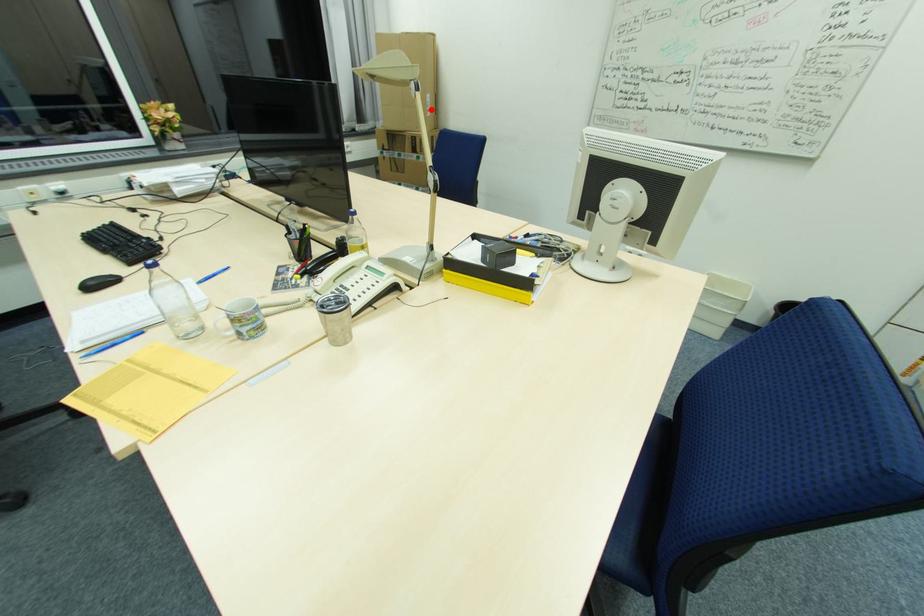
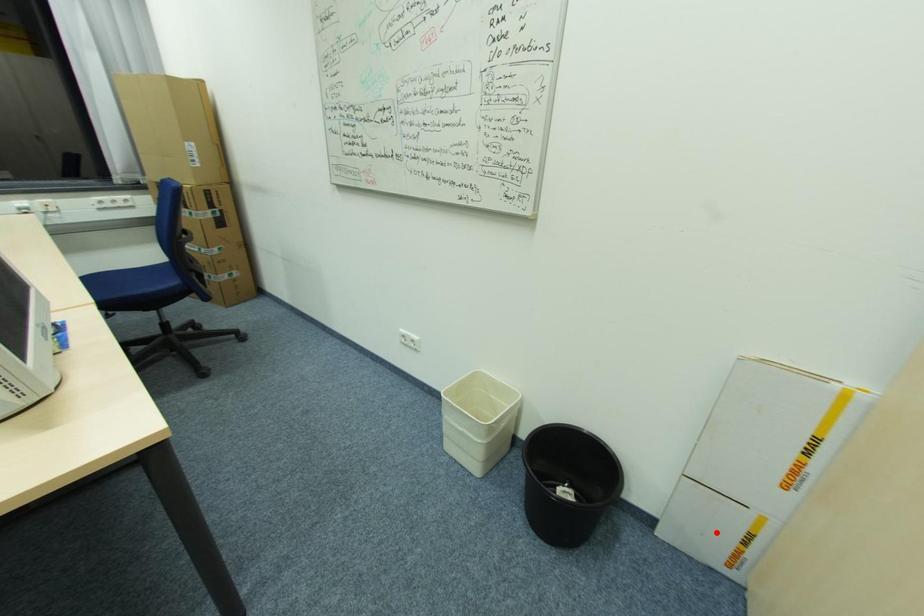
I am providing you with two images of the same scene from different viewpoints. A red point is marked on the first image and another point is marked on the second image. Is the marked point in image1 the same physical position as the marked point in image2?

No